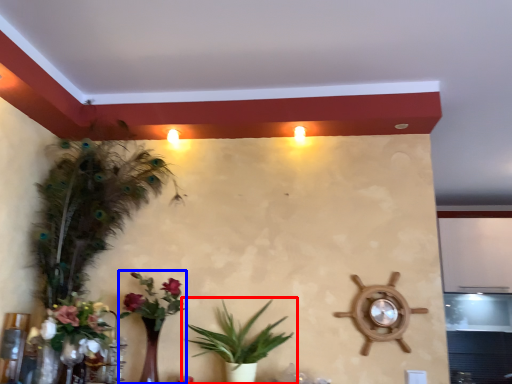
Question: Which object is closer to the camera taking this photo, houseplant (highlighted by a red box) or floral arrangement (highlighted by a blue box)?

Choices:
 (A) houseplant
 (B) floral arrangement

Answer: (A)